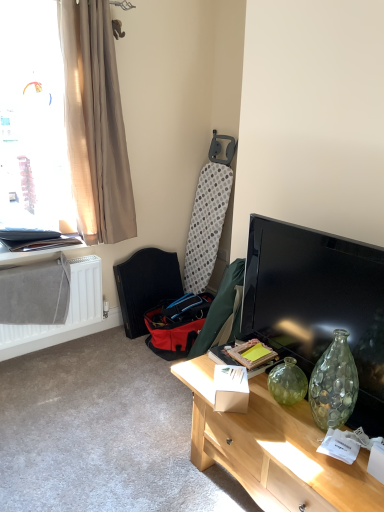
Question: Is red fabric swivel chair at lower left behind white matte radiator at lower left?

Choices:
 (A) yes
 (B) no

Answer: (A)

Question: From a real-world perspective, is red fabric swivel chair at lower left below white matte radiator at lower left?

Choices:
 (A) yes
 (B) no

Answer: (A)

Question: From the image's perspective, would you say red fabric swivel chair at lower left is shown under white matte radiator at lower left?

Choices:
 (A) yes
 (B) no

Answer: (B)

Question: Is red fabric swivel chair at lower left beside white matte radiator at lower left?

Choices:
 (A) yes
 (B) no

Answer: (B)

Question: Considering the relative positions of red fabric swivel chair at lower left and white matte radiator at lower left in the image provided, is red fabric swivel chair at lower left in front of white matte radiator at lower left?

Choices:
 (A) no
 (B) yes

Answer: (A)

Question: Considering the positions of metallic silver frame at left and white matte radiator at lower left in the image, is metallic silver frame at left wider or thinner than white matte radiator at lower left?

Choices:
 (A) wide
 (B) thin

Answer: (A)

Question: In the image, is metallic silver frame at left positioned in front of or behind white matte radiator at lower left?

Choices:
 (A) front
 (B) behind

Answer: (B)

Question: Based on their sizes in the image, would you say metallic silver frame at left is bigger or smaller than white matte radiator at lower left?

Choices:
 (A) big
 (B) small

Answer: (B)

Question: In the image, is metallic silver frame at left on the left side or the right side of white matte radiator at lower left?

Choices:
 (A) right
 (B) left

Answer: (B)

Question: In the image, is black glossy tv at right positioned in front of or behind translucent glass vase at center right?

Choices:
 (A) behind
 (B) front

Answer: (A)

Question: Visually, is black glossy tv at right positioned to the left or to the right of translucent glass vase at center right?

Choices:
 (A) left
 (B) right

Answer: (B)

Question: Considering the positions of black glossy tv at right and translucent glass vase at center right in the image, is black glossy tv at right wider or thinner than translucent glass vase at center right?

Choices:
 (A) thin
 (B) wide

Answer: (A)

Question: Is point (286, 280) closer or farther from the camera than point (347, 470)?

Choices:
 (A) farther
 (B) closer

Answer: (A)

Question: From the image's perspective, is white matte radiator at lower left above or below beige fabric curtain at left?

Choices:
 (A) above
 (B) below

Answer: (B)

Question: Is point (69, 316) positioned closer to the camera than point (97, 172)?

Choices:
 (A) closer
 (B) farther

Answer: (B)